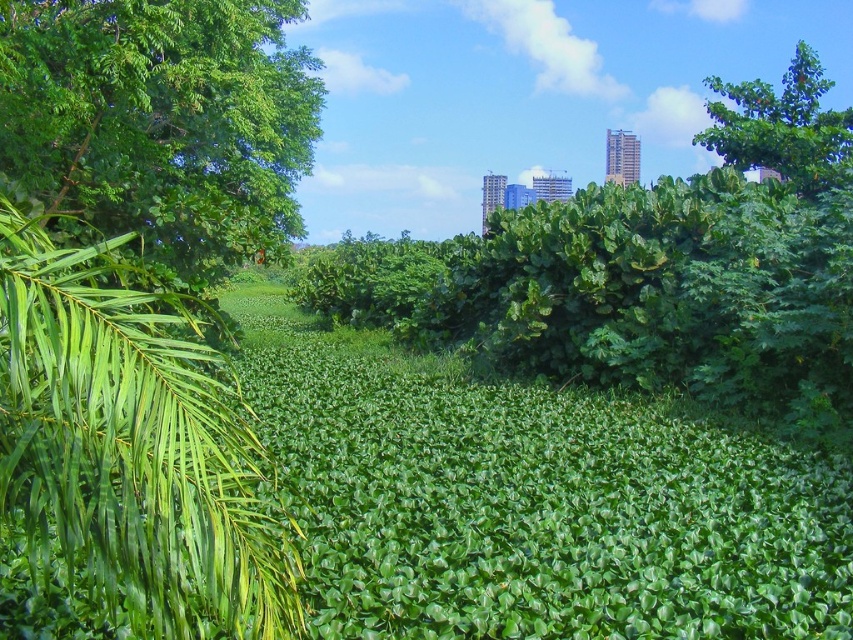
Question: Can you confirm if green leafy palm at left is wider than green leafy tree at upper right?

Choices:
 (A) yes
 (B) no

Answer: (B)

Question: Based on their relative distances, which object is farther from the green leafy tree at upper right?

Choices:
 (A) green leafy palm at left
 (B) green leafy tree at left

Answer: (A)

Question: Which of the following is the farthest from the observer?

Choices:
 (A) (68, 340)
 (B) (763, 92)

Answer: (B)

Question: Is green leafy palm at left to the right of green leafy tree at upper right from the viewer's perspective?

Choices:
 (A) no
 (B) yes

Answer: (A)

Question: Can you confirm if green leafy palm at left is positioned below green leafy tree at left?

Choices:
 (A) yes
 (B) no

Answer: (A)

Question: Which object appears farthest from the camera in this image?

Choices:
 (A) green leafy tree at upper right
 (B) green leafy tree at left
 (C) green leafy palm at left

Answer: (A)